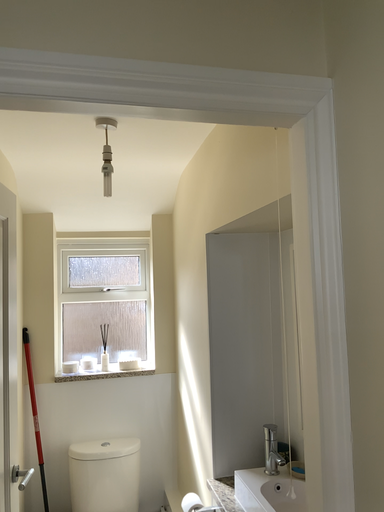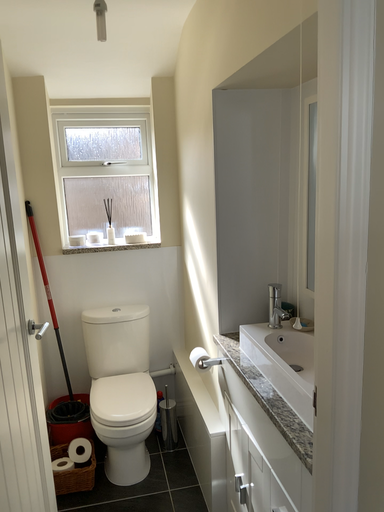
Question: How did the camera likely rotate when shooting the video?

Choices:
 (A) rotated upward
 (B) rotated downward

Answer: (B)